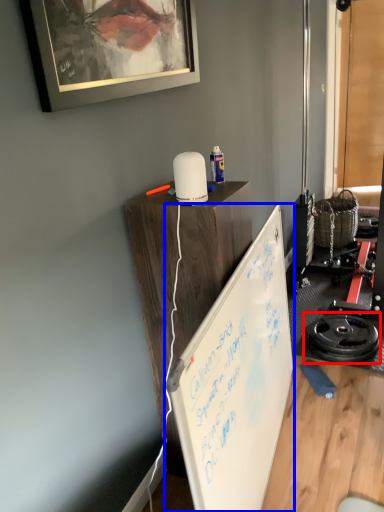
Question: Among these objects, which one is nearest to the camera, wheel (highlighted by a red box) or whiteboard (highlighted by a blue box)?

Choices:
 (A) wheel
 (B) whiteboard

Answer: (B)